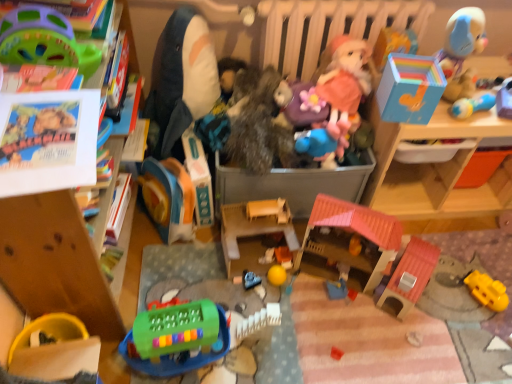
The image size is (512, 384). I want to click on free point above rubber yellow bowl at lower left, arranged as the first toy when viewed from the left (from a real-world perspective), so click(40, 355).